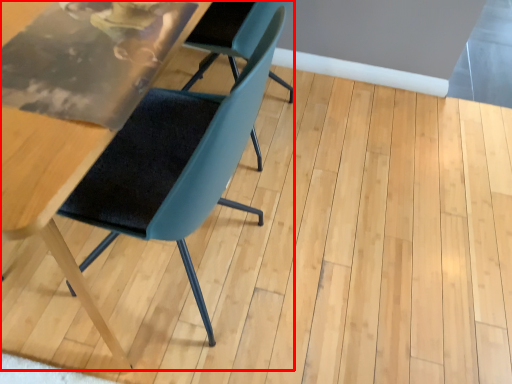
Question: Where is chair (annotated by the red box) located in relation to chair in the image?

Choices:
 (A) left
 (B) right

Answer: (A)